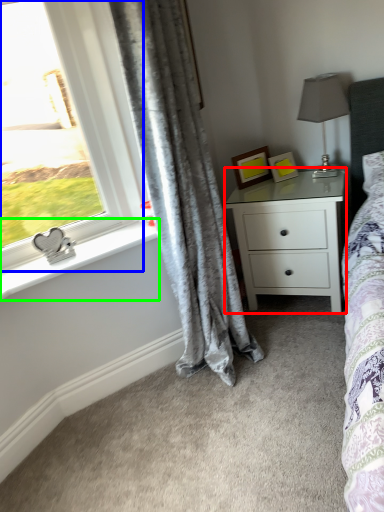
Question: Considering the real-world distances, which object is closest to nightstand (highlighted by a red box)? window (highlighted by a blue box) or window sill (highlighted by a green box).

Choices:
 (A) window
 (B) window sill

Answer: (B)